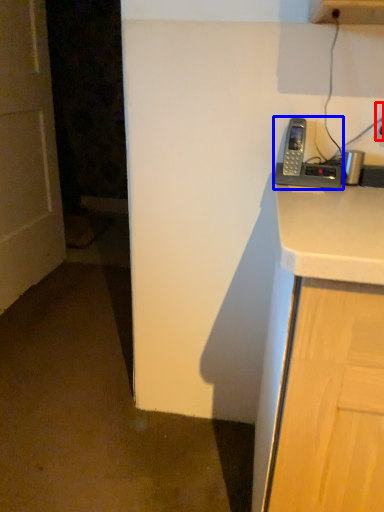
Question: Which object is closer to the camera taking this photo, electric outlet (highlighted by a red box) or corded phone (highlighted by a blue box)?

Choices:
 (A) electric outlet
 (B) corded phone

Answer: (B)